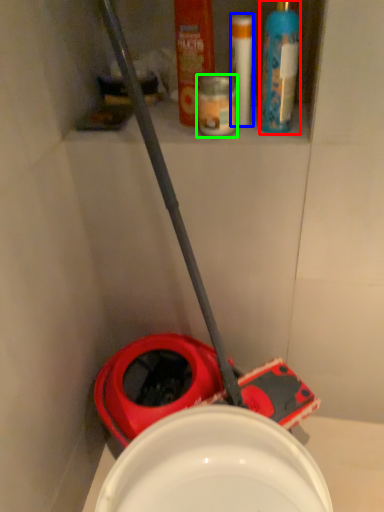
Question: Estimate the real-world distances between objects in this image. Which object is closer to cleaning product (highlighted by a red box), toiletry (highlighted by a blue box) or toiletry (highlighted by a green box)?

Choices:
 (A) toiletry
 (B) toiletry

Answer: (A)